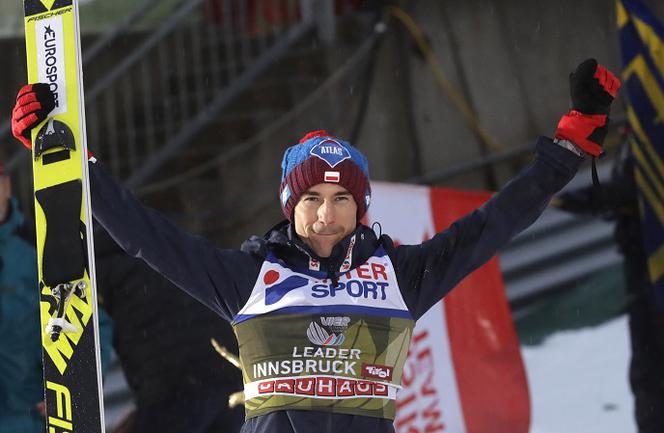
Find the location of a particular element. maroon trim is located at coordinates (309, 174).